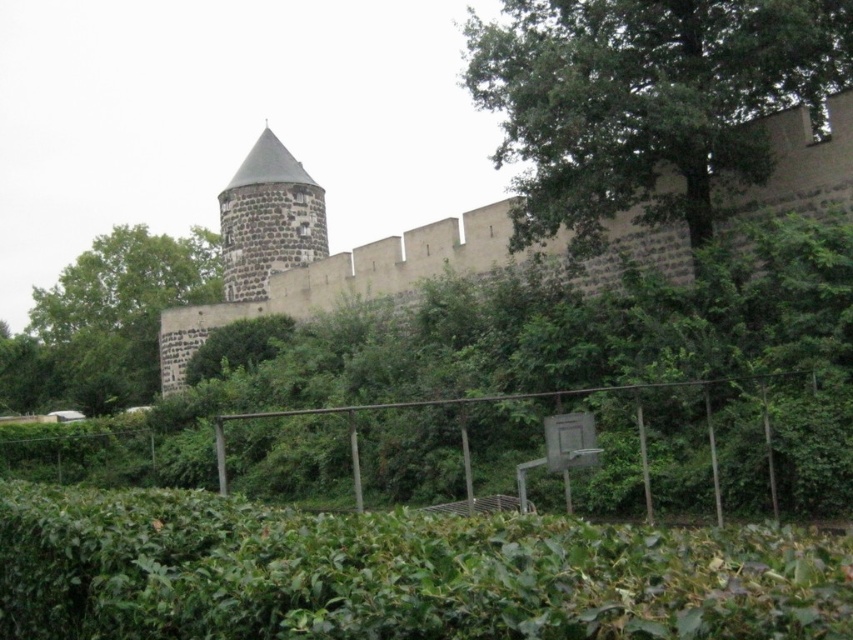
Question: Which object is the closest to the stone gray tower at center?

Choices:
 (A) brown stone wall at upper center
 (B) metallic wire fence at lower center

Answer: (A)

Question: Which object is positioned farthest from the brown stone wall at upper center?

Choices:
 (A) green leafy tree at center
 (B) green leafy hedge at lower center

Answer: (B)

Question: Does green leafy tree at upper right appear on the right side of metallic wire fence at lower center?

Choices:
 (A) yes
 (B) no

Answer: (A)

Question: Which of the following is the farthest from the observer?

Choices:
 (A) (49, 308)
 (B) (790, 161)
 (C) (775, 512)

Answer: (A)

Question: Can you confirm if green leafy tree at upper right is positioned below green leafy tree at center?

Choices:
 (A) yes
 (B) no

Answer: (B)

Question: Observing the image, what is the correct spatial positioning of stone gray tower at center in reference to metallic wire fence at lower center?

Choices:
 (A) above
 (B) below

Answer: (A)